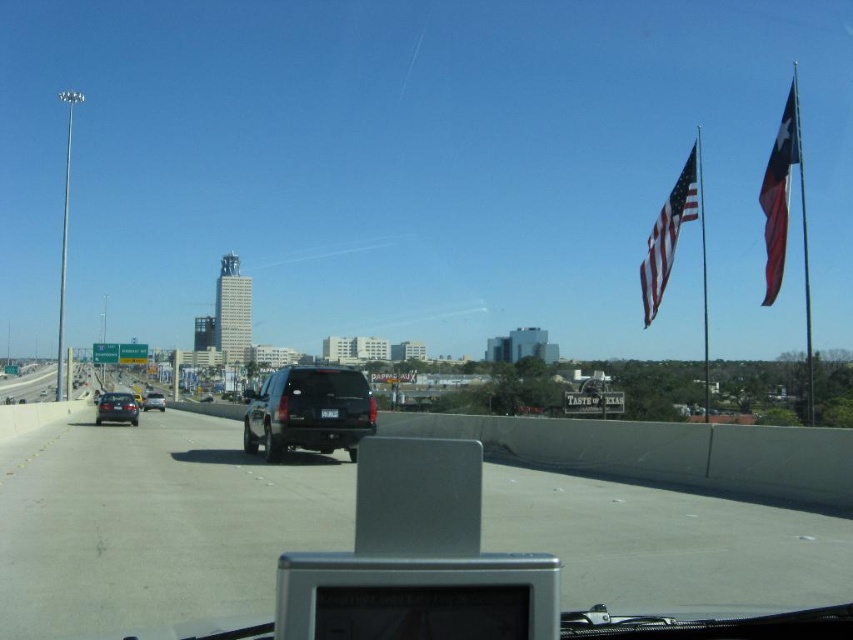
Does black asphalt highway at center have a greater height compared to transparent glass windshield at center?

Yes, black asphalt highway at center is taller than transparent glass windshield at center.

Which is in front, point (578, 570) or point (524, 600)?

Point (524, 600) is more forward.

Find the location of a particular element. black asphalt highway at center is located at coordinates (154, 524).

In the scene shown: Who is shorter, black matte suv at center or shiny black sedan at left?

shiny black sedan at left

Is black matte suv at center above shiny black sedan at left?

Correct, black matte suv at center is located above shiny black sedan at left.

The width and height of the screenshot is (853, 640). In order to click on black matte suv at center in this screenshot , I will do `click(308, 412)`.

Does transparent glass windshield at center have a greater width compared to black matte suv at center?

In fact, transparent glass windshield at center might be narrower than black matte suv at center.

Which is behind, point (410, 621) or point (314, 378)?

The point (314, 378) is more distant.

Does point (396, 636) come farther from viewer compared to point (308, 385)?

No, (396, 636) is closer to viewer.

At what (x,y) coordinates should I click in order to perform the action: click on transparent glass windshield at center. Please return your answer as a coordinate pair (x, y). Looking at the image, I should click on 422,611.